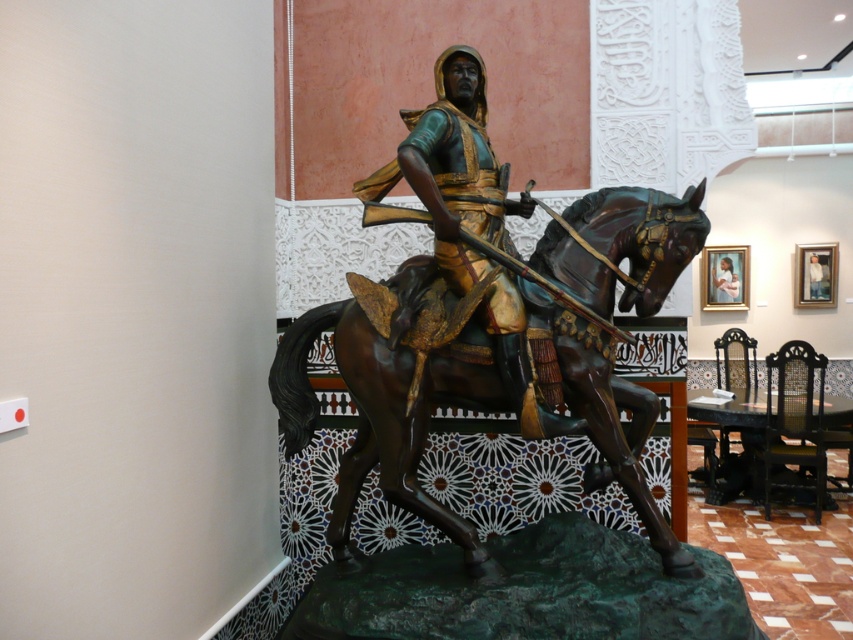
Is bronze/golden at center above bronze statue at center?

Actually, bronze/golden at center is below bronze statue at center.

Which is below, bronze/golden at center or bronze statue at center?

bronze/golden at center is lower down.

Is point (352, 436) positioned in front of point (821, 260)?

Yes.

Where is `bronze/golden at center`? bronze/golden at center is located at coordinates (462, 419).

Which of these two, bronze/golden at center or matte gold armor at center, stands shorter?

matte gold armor at center is shorter.

Is point (599, 520) closer to camera compared to point (724, 296)?

That is True.

The width and height of the screenshot is (853, 640). I want to click on bronze/golden at center, so click(462, 419).

Who is more forward, (x=469, y=262) or (x=728, y=298)?

Positioned in front is point (x=469, y=262).

Who is shorter, green patina armor at center or matte gold armor at center?

matte gold armor at center

Who is more distant from viewer, [532,417] or [735,275]?

Positioned behind is point [735,275].

Identify the location of green patina armor at center. (456, 168).